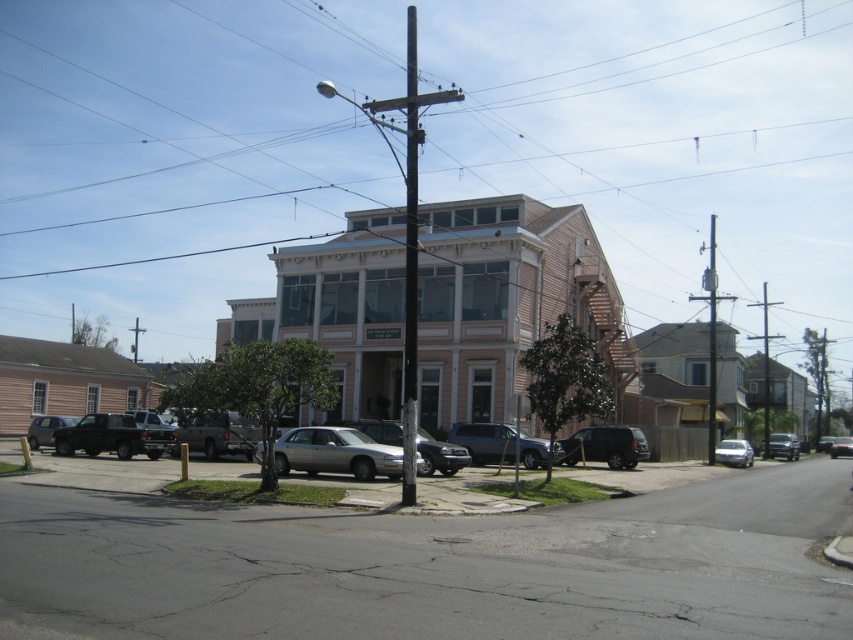
You are a delivery driver who needs to park your truck next to the silver metallic sedan at center and metallic silver car at center. Which vehicle should you park closer to so that your truck has enough space?

You should park closer to the metallic silver car at center because the silver metallic sedan at center occupies less space, leaving more room for the truck next to the metallic silver car at center.